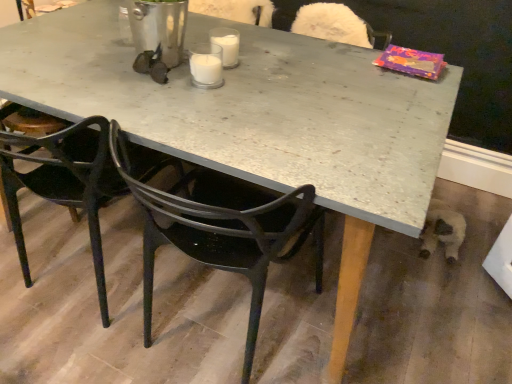
Question: Can you confirm if white glass candle at center, the second coffee cup positioned from the back, is shorter than black plastic chair at center, which is counted as the 1th chair, starting from the right?

Choices:
 (A) no
 (B) yes

Answer: (B)

Question: Considering the relative sizes of white glass candle at center, which is the first coffee cup in front-to-back order, and black plastic chair at center, which ranks as the 2th chair in left-to-right order, in the image provided, is white glass candle at center, which is the first coffee cup in front-to-back order, wider than black plastic chair at center, which ranks as the 2th chair in left-to-right order,?

Choices:
 (A) yes
 (B) no

Answer: (B)

Question: Are white glass candle at center, which is the first coffee cup in front-to-back order, and black plastic chair at center, which is counted as the 1th chair, starting from the right, located far from each other?

Choices:
 (A) yes
 (B) no

Answer: (B)

Question: From the image's perspective, is white glass candle at center, which is the first coffee cup in front-to-back order, under black plastic chair at center, which is counted as the 1th chair, starting from the right?

Choices:
 (A) yes
 (B) no

Answer: (B)

Question: Does white glass candle at center, which is the first coffee cup in front-to-back order, appear on the right side of black plastic chair at center, which ranks as the 2th chair in left-to-right order?

Choices:
 (A) no
 (B) yes

Answer: (A)

Question: In terms of width, does black plastic chair at center, which ranks as the 2th chair in left-to-right order, look wider or thinner when compared to matte black chair at lower left, marked as the 2th chair in a right-to-left arrangement?

Choices:
 (A) wide
 (B) thin

Answer: (B)

Question: From a real-world perspective, is black plastic chair at center, which ranks as the 2th chair in left-to-right order, physically located above or below matte black chair at lower left, arranged as the 1th chair when viewed from the left?

Choices:
 (A) below
 (B) above

Answer: (A)

Question: From their relative heights in the image, would you say black plastic chair at center, which is counted as the 1th chair, starting from the right, is taller or shorter than matte black chair at lower left, marked as the 2th chair in a right-to-left arrangement?

Choices:
 (A) tall
 (B) short

Answer: (A)

Question: From the image's perspective, is black plastic chair at center, which is counted as the 1th chair, starting from the right, located above or below matte black chair at lower left, marked as the 2th chair in a right-to-left arrangement?

Choices:
 (A) below
 (B) above

Answer: (A)

Question: Is black plastic chair at center, which is counted as the 1th chair, starting from the right, in front of or behind white glass candle at center, which is the first coffee cup in front-to-back order, in the image?

Choices:
 (A) front
 (B) behind

Answer: (A)

Question: Considering the positions of black plastic chair at center, which ranks as the 2th chair in left-to-right order, and white glass candle at center, which is the first coffee cup in front-to-back order, in the image, is black plastic chair at center, which ranks as the 2th chair in left-to-right order, taller or shorter than white glass candle at center, which is the first coffee cup in front-to-back order,?

Choices:
 (A) short
 (B) tall

Answer: (B)

Question: From the image's perspective, is black plastic chair at center, which ranks as the 2th chair in left-to-right order, positioned above or below white glass candle at center, the second coffee cup positioned from the back?

Choices:
 (A) below
 (B) above

Answer: (A)

Question: Looking at the image, does black plastic chair at center, which is counted as the 1th chair, starting from the right, seem bigger or smaller compared to white glass candle at center, the second coffee cup positioned from the back?

Choices:
 (A) small
 (B) big

Answer: (B)

Question: Visually, is white glass at center, the 2th coffee cup in the front-to-back sequence, positioned to the left or to the right of white glass candle at center, the second coffee cup positioned from the back?

Choices:
 (A) left
 (B) right

Answer: (B)

Question: Considering their positions, is white glass at center, the 2th coffee cup in the front-to-back sequence, located in front of or behind white glass candle at center, which is the first coffee cup in front-to-back order?

Choices:
 (A) behind
 (B) front

Answer: (A)